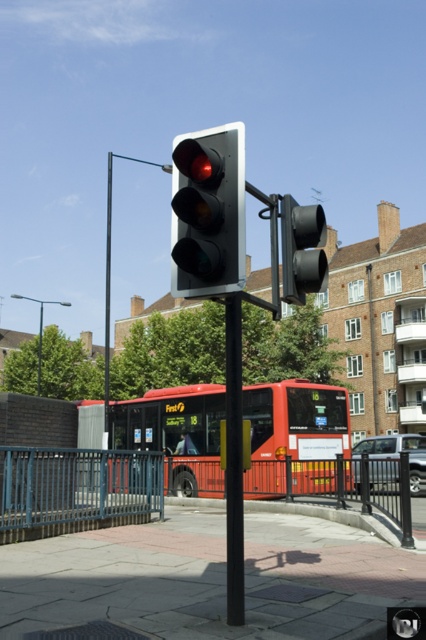
Question: Among these points, which one is nearest to the camera?

Choices:
 (A) (66, 499)
 (B) (305, 205)

Answer: (A)

Question: Which object appears closest to the camera in this image?

Choices:
 (A) black matte pole at center
 (B) metallic blue bus stop at lower left

Answer: (A)

Question: Does red matte bus at center have a smaller size compared to black matte traffic light at center?

Choices:
 (A) yes
 (B) no

Answer: (B)

Question: Is metallic blue bus stop at lower left positioned in front of black matte pole at center?

Choices:
 (A) no
 (B) yes

Answer: (A)

Question: Does red matte bus at center have a lesser width compared to black matte traffic light at center?

Choices:
 (A) yes
 (B) no

Answer: (B)

Question: Which of the following is the closest to the observer?

Choices:
 (A) (321, 241)
 (B) (22, 468)

Answer: (A)